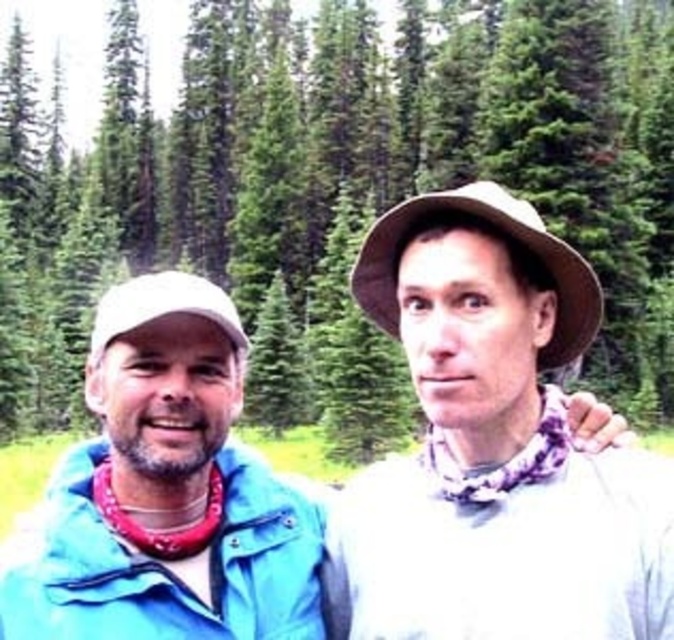
Question: Among these objects, which one is nearest to the camera?

Choices:
 (A) blue fabric jacket at center
 (B) green textured pine trees at upper center

Answer: (A)

Question: Is blue fabric jacket at center to the right of green textured pine trees at upper center from the viewer's perspective?

Choices:
 (A) yes
 (B) no

Answer: (B)

Question: Can you confirm if blue fabric jacket at center is positioned above blue fabric jacket at left?

Choices:
 (A) yes
 (B) no

Answer: (B)

Question: Among these points, which one is farthest from the camera?

Choices:
 (A) (402, 74)
 (B) (20, 532)

Answer: (A)

Question: Can you confirm if blue fabric jacket at center is positioned below green textured pine trees at upper center?

Choices:
 (A) yes
 (B) no

Answer: (A)

Question: Which object appears farthest from the camera in this image?

Choices:
 (A) green textured pine trees at upper center
 (B) blue fabric jacket at center
 (C) blue fabric jacket at left

Answer: (A)